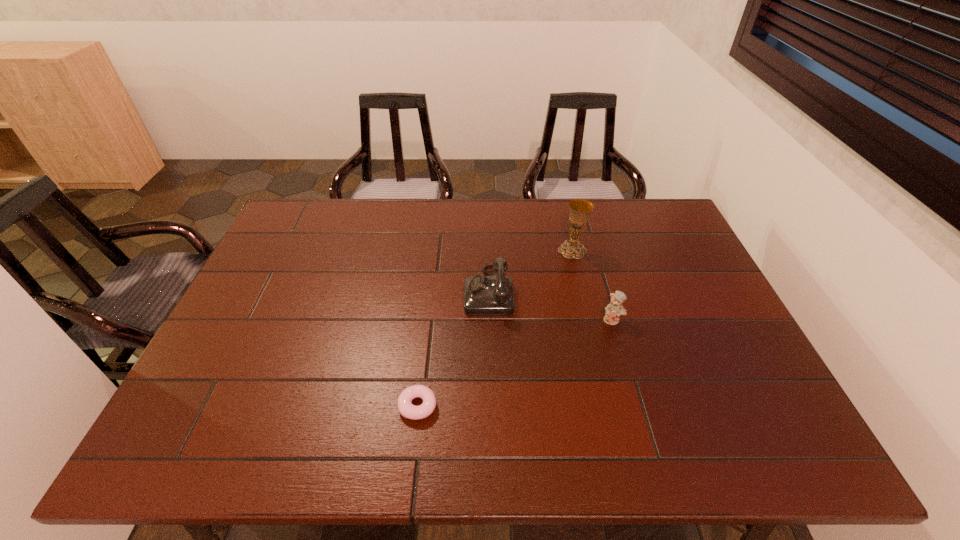
Locate an element on the screen. The width and height of the screenshot is (960, 540). object that can be found as the third closest to the tallest object is located at coordinates (405, 407).

The height and width of the screenshot is (540, 960). What are the coordinates of `free spot that satisfies the following two spatial constraints: 1. on the front side of the farthest object; 2. on the dial of the telephone` in the screenshot? It's located at (582, 291).

At what (x,y) coordinates should I click in order to perform the action: click on vacant position in the image that satisfies the following two spatial constraints: 1. on the front side of the chalice; 2. on the dial of the telephone. Please return your answer as a coordinate pair (x, y). Looking at the image, I should click on (582, 291).

The height and width of the screenshot is (540, 960). I want to click on vacant region that satisfies the following two spatial constraints: 1. on the dial of the third object from right to left; 2. on the front side of the nearest object, so 491,406.